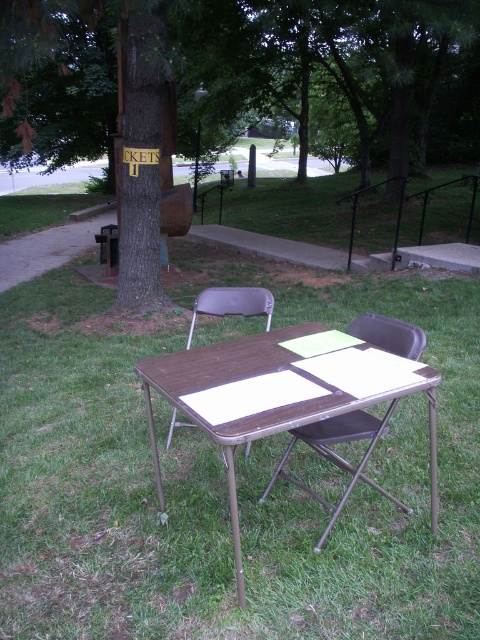
What are the coordinates of the brown wood tree at center?

The brown wood tree at center is located at coordinates point [220,61].